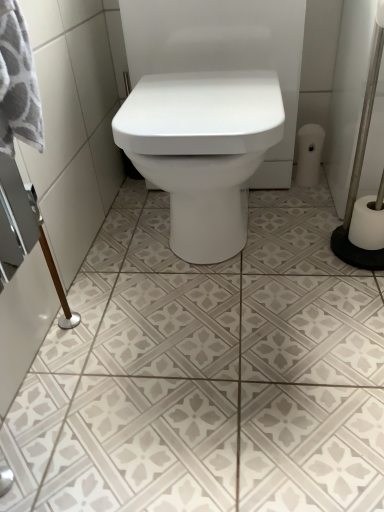
Question: Looking at the image, does white matte toilet paper at right, the 1th toilet paper positioned from the left, seem bigger or smaller compared to white textured tile at center?

Choices:
 (A) big
 (B) small

Answer: (B)

Question: Is point (306, 141) positioned closer to the camera than point (165, 389)?

Choices:
 (A) farther
 (B) closer

Answer: (A)

Question: Which object is the closest to the white textured tile at center?

Choices:
 (A) white matte toilet paper at right, which is counted as the 1th toilet paper, starting from the top
 (B) white matte toilet paper at right, which is the 1th toilet paper from front to back

Answer: (B)

Question: Which object is the closest to the white matte toilet paper at right, which is the 1th toilet paper from front to back?

Choices:
 (A) white matte toilet paper at right, marked as the second toilet paper in a right-to-left arrangement
 (B) white textured tile at center

Answer: (A)